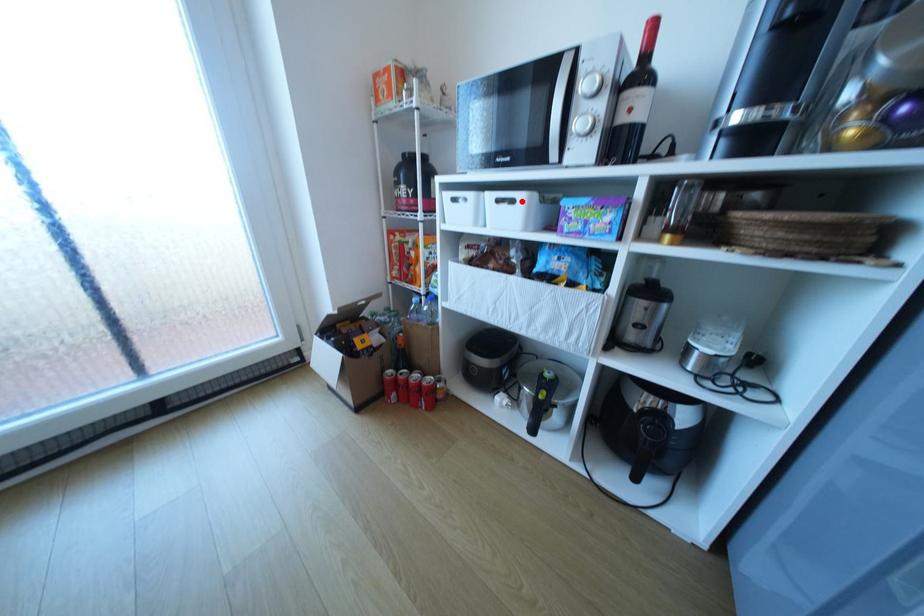
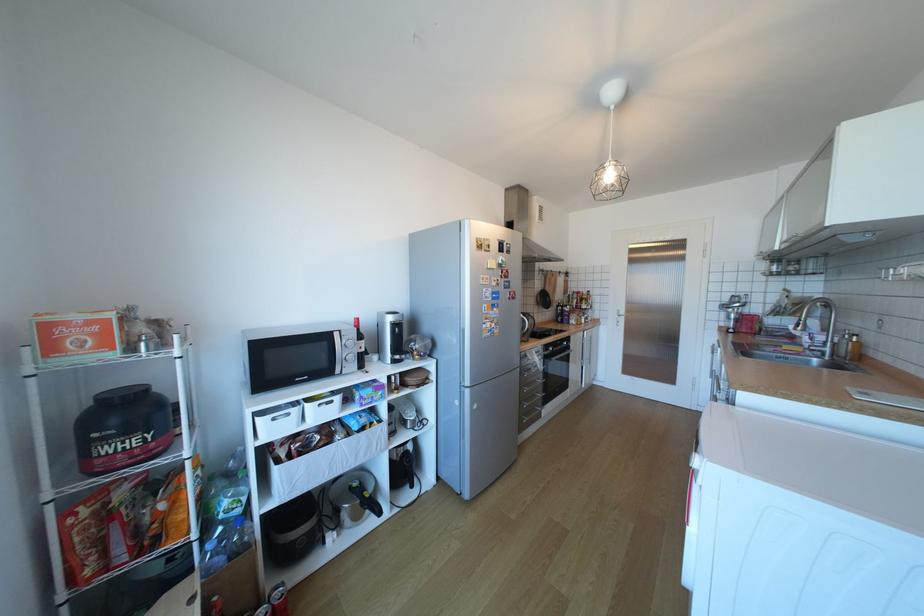
Question: I am providing you with two images of the same scene from different viewpoints. A red point is marked on the first image. Is the red point's position out of view in image 2?

Choices:
 (A) Yes
 (B) No

Answer: (B)